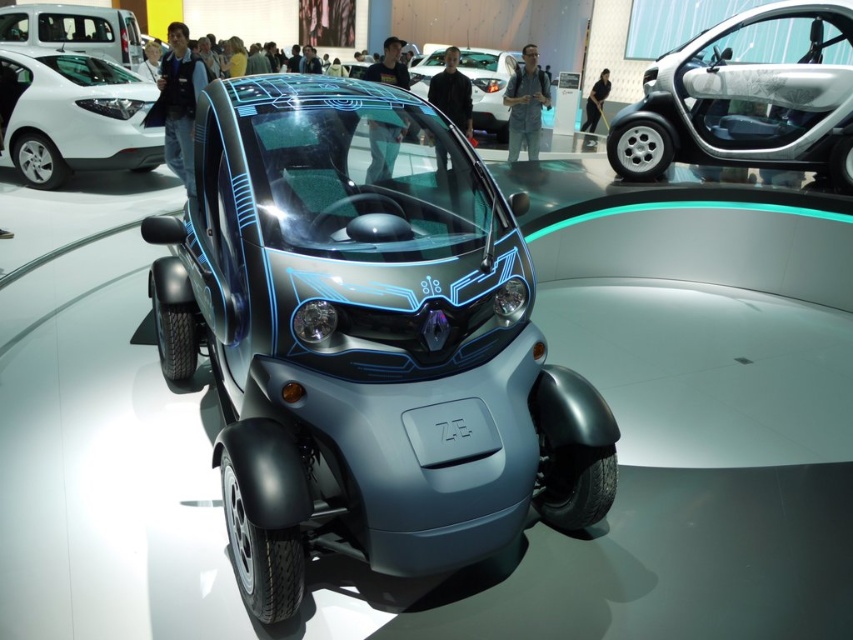
Is glossy metallic concept car at center smaller than white glossy hatchback at upper left?

Actually, glossy metallic concept car at center might be larger than white glossy hatchback at upper left.

Who is higher up, glossy metallic concept car at center or white glossy hatchback at upper left?

white glossy hatchback at upper left

Between point (310, 237) and point (80, 99), which one is positioned in front?

Point (310, 237)

Image resolution: width=853 pixels, height=640 pixels. Identify the location of glossy metallic concept car at center. (366, 339).

Is white glossy hatchback at upper left bigger than metallic blue car at center?

Yes, white glossy hatchback at upper left is bigger than metallic blue car at center.

This screenshot has width=853, height=640. What do you see at coordinates (73, 116) in the screenshot?
I see `white glossy hatchback at upper left` at bounding box center [73, 116].

Identify the location of white glossy hatchback at upper left. This screenshot has width=853, height=640. (73, 116).

Image resolution: width=853 pixels, height=640 pixels. What do you see at coordinates (747, 97) in the screenshot? I see `metallic silver car at center` at bounding box center [747, 97].

Consider the image. Between metallic silver car at center and metallic blue car at center, which one has more height?

With more height is metallic blue car at center.

Does point (714, 56) come behind point (426, 77)?

No, it is not.

Find the location of `metallic silver car at center`. metallic silver car at center is located at coordinates (747, 97).